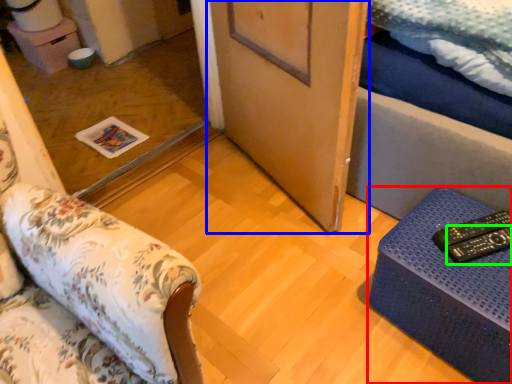
Question: Which is nearer to the furniture (highlighted by a red box)? door (highlighted by a blue box) or remote (highlighted by a green box).

Choices:
 (A) door
 (B) remote

Answer: (B)